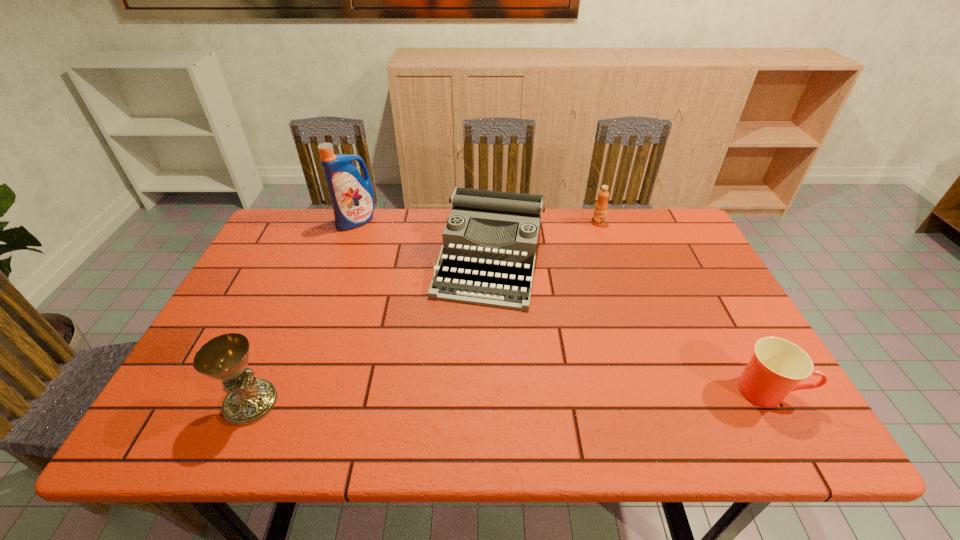
At what (x,y) coordinates should I click in order to perform the action: click on cup positioned at the near edge. Please return your answer as a coordinate pair (x, y). The image size is (960, 540). Looking at the image, I should click on (777, 365).

I want to click on object that is at the left edge, so click(x=225, y=357).

Locate an element on the screen. This screenshot has width=960, height=540. object at the right edge is located at coordinates (777, 365).

Image resolution: width=960 pixels, height=540 pixels. Find the location of `object that is at the near left corner`. object that is at the near left corner is located at coordinates [x=225, y=357].

Find the location of a particular element. Image resolution: width=960 pixels, height=540 pixels. object that is positioned at the near right corner is located at coordinates (777, 365).

Where is `free space at the far edge of the desktop`? Image resolution: width=960 pixels, height=540 pixels. free space at the far edge of the desktop is located at coordinates coord(420,234).

Where is `vacant position at the near edge of the desktop`? vacant position at the near edge of the desktop is located at coordinates (481, 395).

Locate an element on the screen. The height and width of the screenshot is (540, 960). free space at the left edge of the desktop is located at coordinates (259, 363).

Where is `vacant space at the right edge of the desktop`? vacant space at the right edge of the desktop is located at coordinates (727, 332).

Locate an element on the screen. The height and width of the screenshot is (540, 960). vacant space at the far right corner of the desktop is located at coordinates coord(655,223).